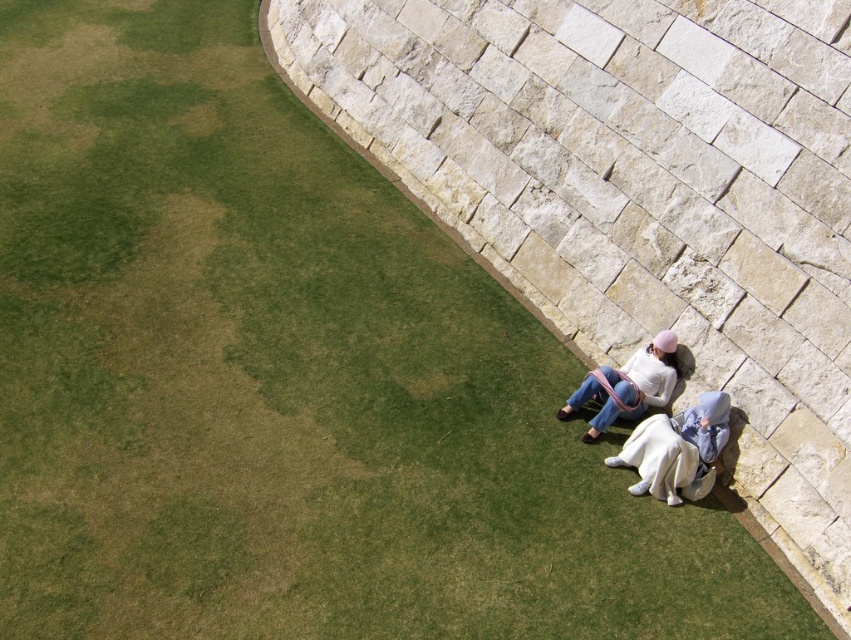
Question: Does white cotton dress at lower right have a lesser width compared to white cotton sweater at lower right?

Choices:
 (A) no
 (B) yes

Answer: (B)

Question: Among these points, which one is farthest from the camera?

Choices:
 (A) (698, 404)
 (B) (600, 413)

Answer: (B)

Question: Is white cotton dress at lower right behind white cotton sweater at lower right?

Choices:
 (A) no
 (B) yes

Answer: (A)

Question: Among these objects, which one is nearest to the camera?

Choices:
 (A) white cotton sweater at lower right
 (B) white cotton dress at lower right

Answer: (B)

Question: Considering the relative positions of white cotton dress at lower right and white cotton sweater at lower right in the image provided, where is white cotton dress at lower right located with respect to white cotton sweater at lower right?

Choices:
 (A) left
 (B) right

Answer: (B)

Question: Among these objects, which one is nearest to the camera?

Choices:
 (A) white cotton sweater at lower right
 (B) white cotton dress at lower right

Answer: (B)